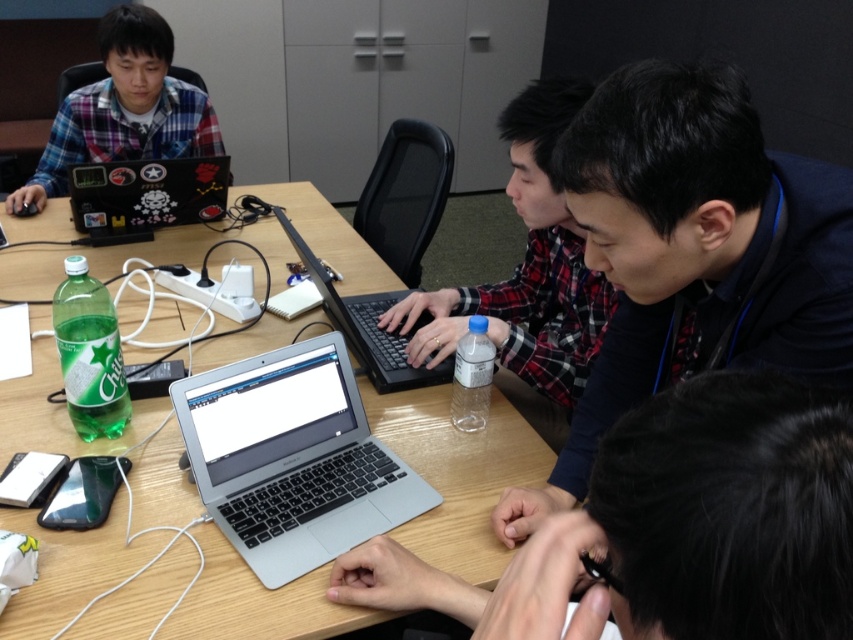
Question: Can you confirm if wooden table at center is positioned to the right of black matte laptop at center?

Choices:
 (A) yes
 (B) no

Answer: (B)

Question: Which of the following is the farthest from the observer?

Choices:
 (A) black matte laptop at center
 (B) silver metallic laptop at center

Answer: (B)

Question: Which point appears closest to the camera in this image?

Choices:
 (A) (x=350, y=300)
 (B) (x=434, y=451)
 (C) (x=183, y=88)
 (D) (x=553, y=88)

Answer: (D)

Question: Is silver metallic laptop at center below plaid fabric shirt at center?

Choices:
 (A) no
 (B) yes

Answer: (B)

Question: Considering the relative positions of wooden table at center and plaid fabric shirt at upper left in the image provided, where is wooden table at center located with respect to plaid fabric shirt at upper left?

Choices:
 (A) right
 (B) left

Answer: (A)

Question: Which of the following is the farthest from the observer?

Choices:
 (A) sticker-covered plastic laptop at upper left
 (B) black matte laptop at center
 (C) plaid fabric shirt at upper left
 (D) silver/black plastic laptop at center

Answer: (C)